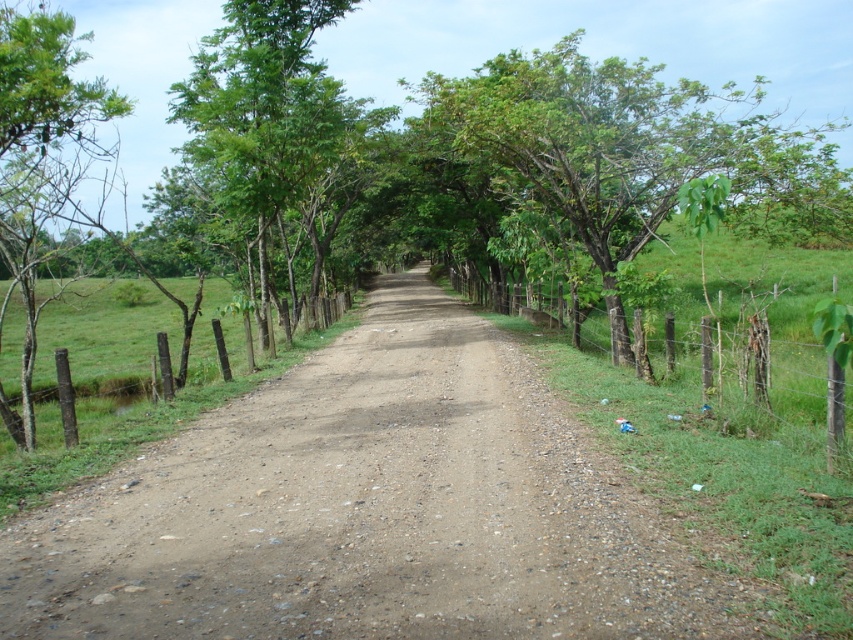
Does point (234, 476) come in front of point (312, 134)?

Yes, it is.

Between dull brown dirt track at center and green leafy tree at upper left, which one is positioned higher?

green leafy tree at upper left is higher up.

I want to click on dull brown dirt track at center, so click(367, 509).

Between brown wooden fence at left and wooden post fence at right, which one appears on the left side from the viewer's perspective?

From the viewer's perspective, brown wooden fence at left appears more on the left side.

Is point (41, 436) positioned behind point (670, 339)?

No, (41, 436) is in front of (670, 339).

Measure the distance between point (120,401) and camera.

A distance of 16.26 meters exists between point (120,401) and camera.

The image size is (853, 640). I want to click on brown wooden fence at left, so click(138, 362).

Is green leafy tree at center wider than wooden post fence at right?

Yes, green leafy tree at center is wider than wooden post fence at right.

Which is more to the right, green leafy tree at center or wooden post fence at right?

Positioned to the right is green leafy tree at center.

This screenshot has height=640, width=853. In order to click on green leafy tree at center in this screenshot , I will do `click(637, 147)`.